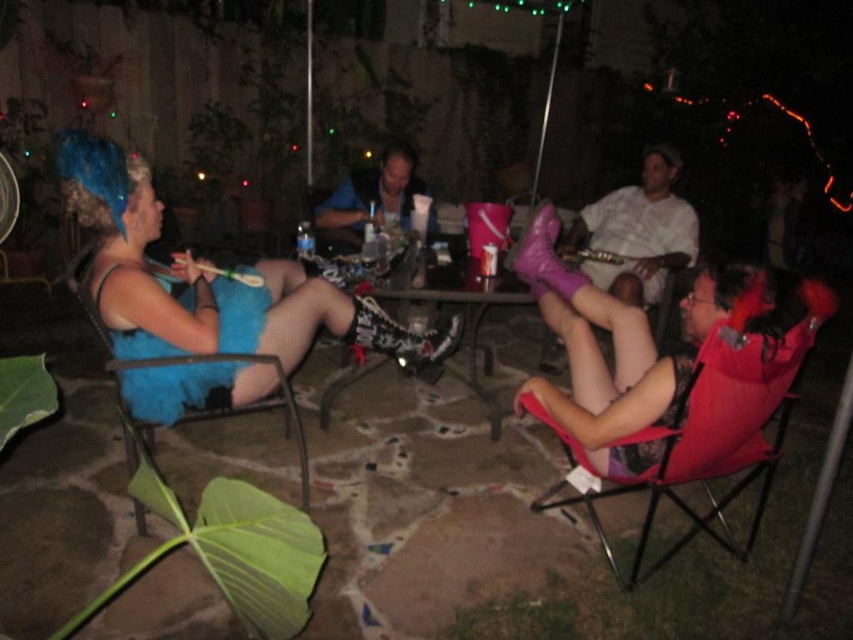
You are a caterer at the event and need to place a 3.5 feet wide tray between the matte red folding chair at lower right and the blue fuzzy dress at left. Can the tray fit without touching either object?

The distance between the matte red folding chair at lower right and the blue fuzzy dress at left is 4.16 feet. Since the tray is 3.5 feet wide, it can fit as there is enough space between them.

You are a photographer at the event and want to capture a closeup of the pink suede boots at right. Based on their position, where should you aim the camera?

The pink suede boots at right are located at the 2D coordinates point (601, 360), so you should aim the camera at that position to capture them.

You are a guest at the nighttime gathering and want to place your drink on the metallic silver table at center without spilling it. Where should you place your drink relative to the pink suede boots at right?

The pink suede boots at right is located below the metallic silver table at center, so placing your drink on the table above the boots would keep it stable and prevent spilling.